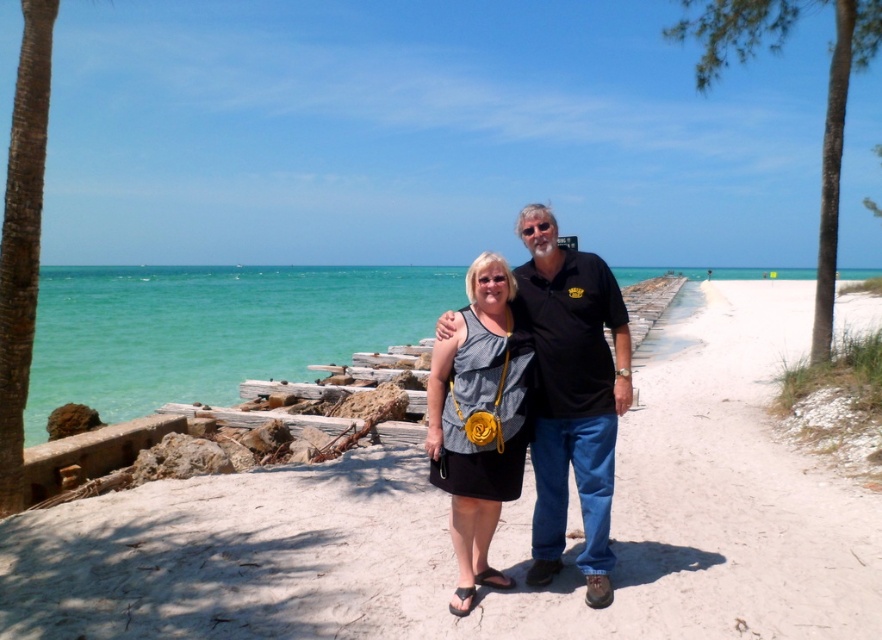
Question: Which object is farther from the camera taking this photo?

Choices:
 (A) green leafy palm tree at upper right
 (B) clear blue water at center
 (C) white sand beach at center

Answer: (A)

Question: In this image, where is clear blue water at center located relative to matte gray dress at center?

Choices:
 (A) right
 (B) left

Answer: (B)

Question: Considering the relative positions of white sand beach at center and clear blue water at center in the image provided, where is white sand beach at center located with respect to clear blue water at center?

Choices:
 (A) left
 (B) right

Answer: (B)

Question: Is matte gray dress at center wider than green leafy palm tree at upper right?

Choices:
 (A) no
 (B) yes

Answer: (A)

Question: Which of the following is the farthest from the observer?

Choices:
 (A) (443, 460)
 (B) (574, 266)
 (C) (832, 244)

Answer: (C)

Question: Which of these objects is positioned closest to the matte gray dress at center?

Choices:
 (A) white sand beach at center
 (B) green leafy palm tree at upper right

Answer: (A)